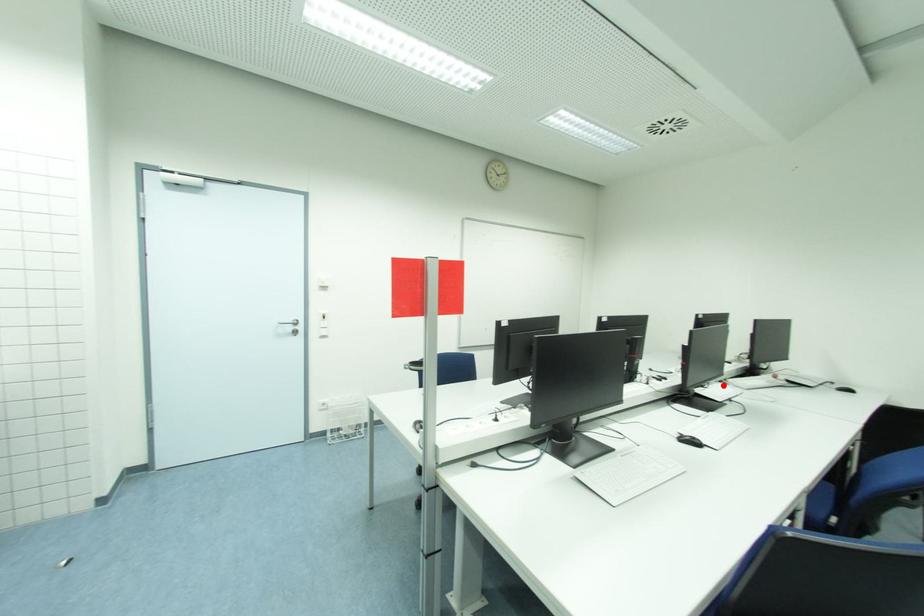
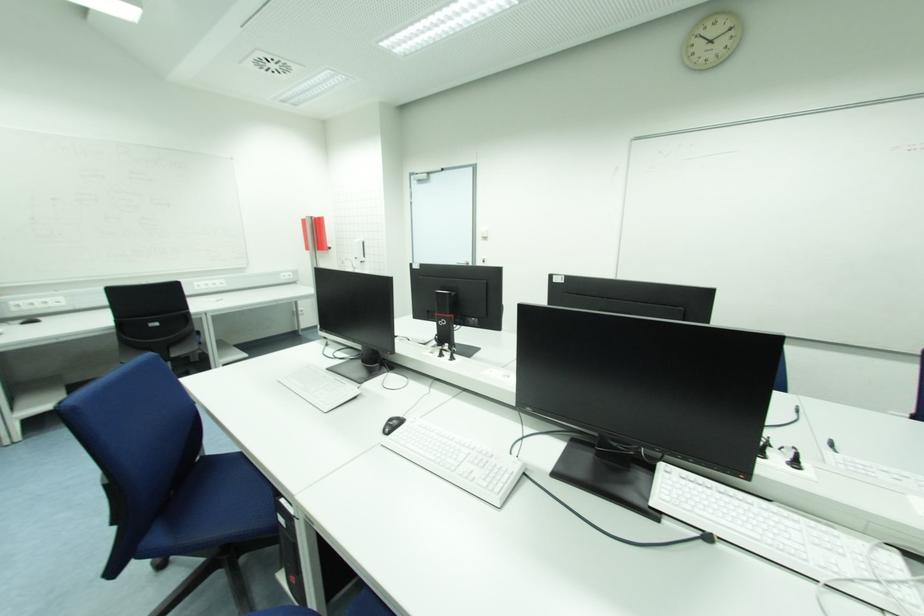
Find the pixel in the second image that matches the highlighted location in the first image.

(900, 560)